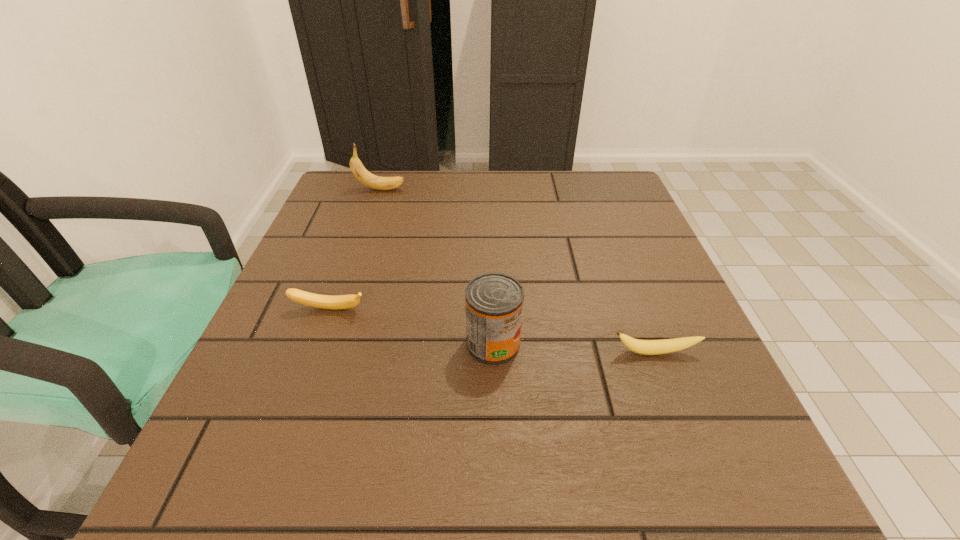
Identify the location of empty location between the can and the second nearest banana. (412, 326).

You are a GUI agent. You are given a task and a screenshot of the screen. Output one action in this format:
    pyautogui.click(x=<x>, y=<y>)
    Task: Click on the vacant space that's between the farthest banana and the rightmost banana
    The width and height of the screenshot is (960, 540).
    Given the screenshot: What is the action you would take?
    pyautogui.click(x=517, y=271)

Identify the location of free area in between the second object from right to left and the rightmost banana. The image size is (960, 540). (574, 348).

The width and height of the screenshot is (960, 540). I want to click on free space between the tallest banana and the third nearest object, so click(355, 249).

Identify the location of free space between the farthest object and the third object from left to right. The width and height of the screenshot is (960, 540). (437, 266).

At what (x,y) coordinates should I click in order to perform the action: click on free area in between the nearest banana and the can. Please return your answer as a coordinate pair (x, y). This screenshot has height=540, width=960. Looking at the image, I should click on [574, 348].

I want to click on free space between the rightmost object and the third object from left to right, so click(x=574, y=348).

Where is `vacant space that is in between the can and the third nearest object`? The height and width of the screenshot is (540, 960). vacant space that is in between the can and the third nearest object is located at coordinates (412, 326).

The width and height of the screenshot is (960, 540). In order to click on vacant point located between the farthest object and the rightmost object in this screenshot , I will do `click(517, 271)`.

Locate an element on the screen. The height and width of the screenshot is (540, 960). free space that is in between the second nearest banana and the farthest banana is located at coordinates (355, 249).